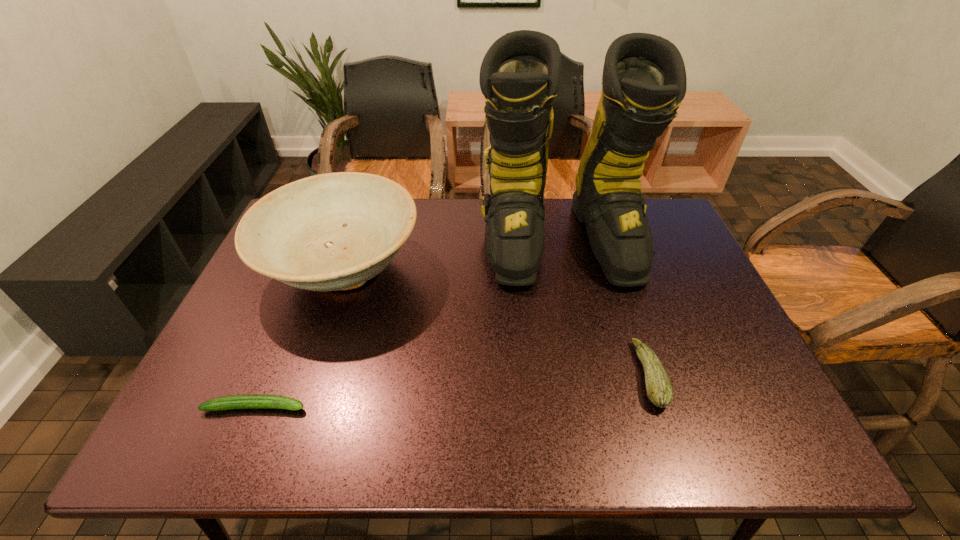
The image size is (960, 540). In order to click on free spot located 0.180m at the stem end of the taller zucchini in this screenshot , I will do `click(557, 375)`.

Find the location of a particular element. The width and height of the screenshot is (960, 540). vacant area located 0.080m on the front-facing side of the left zucchini is located at coordinates (345, 407).

Locate an element on the screen. Image resolution: width=960 pixels, height=540 pixels. ski boots present at the far edge is located at coordinates 644,80.

Where is `dish present at the far edge`? dish present at the far edge is located at coordinates (328, 232).

Where is `object situated at the near edge`? The height and width of the screenshot is (540, 960). object situated at the near edge is located at coordinates (249, 401).

Locate an element on the screen. This screenshot has width=960, height=540. dish at the left edge is located at coordinates (328, 232).

What are the coordinates of `zucchini that is at the left edge` in the screenshot? It's located at (249, 401).

This screenshot has height=540, width=960. What are the coordinates of `object positioned at the right edge` in the screenshot? It's located at (644, 80).

This screenshot has height=540, width=960. Find the location of `object situated at the far left corner`. object situated at the far left corner is located at coordinates coord(328,232).

Locate an element on the screen. object at the near left corner is located at coordinates (249, 401).